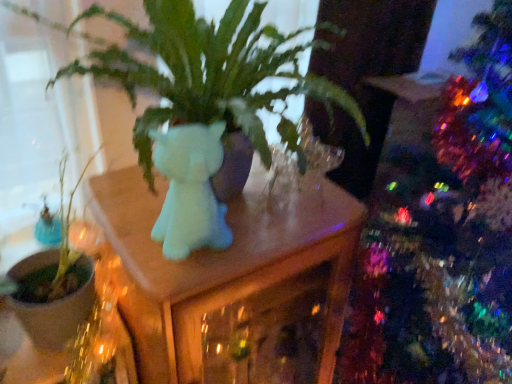
Question: From the image's perspective, relative to green matte plant at left, is matte white cat at center above or below?

Choices:
 (A) below
 (B) above

Answer: (B)

Question: In terms of size, does matte white cat at center appear bigger or smaller than green matte plant at left?

Choices:
 (A) small
 (B) big

Answer: (A)

Question: Which of these objects is positioned closest to the matte white cat at center?

Choices:
 (A) matte white unicorn at center
 (B) green matte plant at left

Answer: (A)

Question: Based on their relative distances, which object is farther from the matte white cat at center?

Choices:
 (A) matte white unicorn at center
 (B) green matte plant at left

Answer: (B)